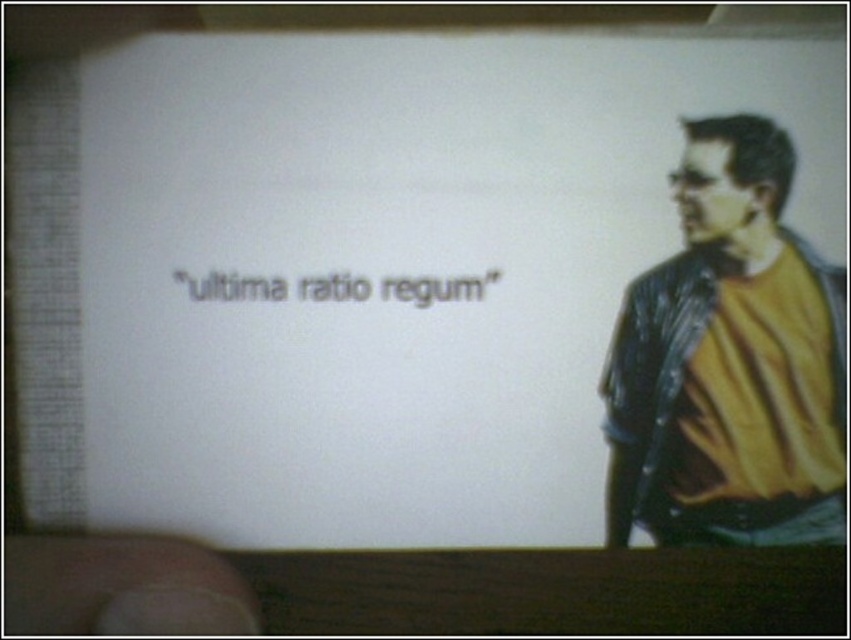
Measure the distance from smooth skin finger at lower left to black text at center.

smooth skin finger at lower left is 14.94 centimeters away from black text at center.

Can you confirm if smooth skin finger at lower left is thinner than black text at center?

Indeed, smooth skin finger at lower left has a lesser width compared to black text at center.

Is point (190, 596) positioned behind point (237, 289)?

No, it is not.

The width and height of the screenshot is (851, 640). In order to click on smooth skin finger at lower left in this screenshot , I will do `click(123, 588)`.

Consider the image. Measure the distance between matte black leather jacket at right and camera.

The distance of matte black leather jacket at right from camera is 45.64 centimeters.

Between matte black leather jacket at right and black text at center, which one is positioned lower?

matte black leather jacket at right is lower down.

Who is more forward, [647,390] or [389,289]?

Point [389,289] is more forward.

Find the location of a particular element. The width and height of the screenshot is (851, 640). matte black leather jacket at right is located at coordinates (729, 362).

Between matte black leather jacket at right and smooth skin finger at lower left, which one appears on the left side from the viewer's perspective?

From the viewer's perspective, smooth skin finger at lower left appears more on the left side.

Between point (726, 314) and point (213, 611), which one is positioned in front?

Point (213, 611) is in front.

The image size is (851, 640). What are the coordinates of `matte black leather jacket at right` in the screenshot? It's located at (729, 362).